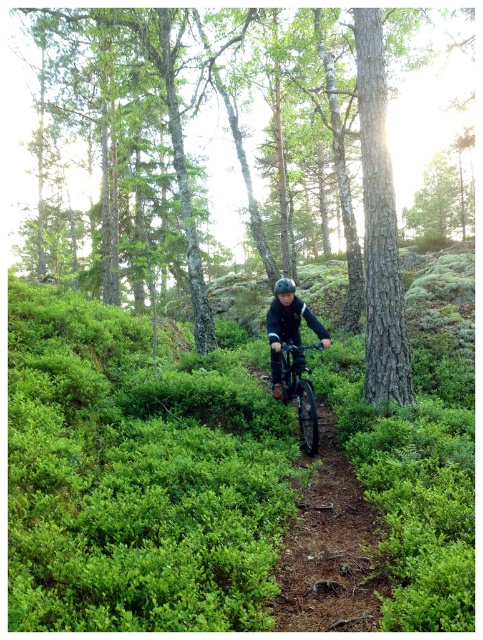
You are a hiker trying to take a photo of the metallic matte bicycle at center from the rough bark tree at center. In which direction should you move relative to the tree to get a clear view of the bicycle?

You should move to the left relative to the rough bark tree at center to get a clear view of the metallic matte bicycle at center because the tree is to the right of the bicycle.

You are a hiker who wants to take a photo of the rough bark tree at center and the black matte helmet at center from your current position. Which object should you focus on first to ensure it appears sharp in the photo?

You should focus on the rough bark tree at center first because it is closer to you than the black matte helmet at center, so it will be in focus first.